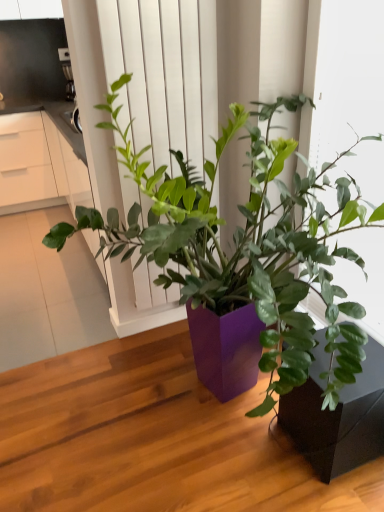
Question: Does matte black pot at lower right have a lesser height compared to white matte screen door at center?

Choices:
 (A) no
 (B) yes

Answer: (B)

Question: Is matte black pot at lower right not close to white matte screen door at center?

Choices:
 (A) yes
 (B) no

Answer: (A)

Question: Is matte black pot at lower right behind white matte screen door at center?

Choices:
 (A) yes
 (B) no

Answer: (B)

Question: Is matte black pot at lower right closer to the viewer compared to white matte screen door at center?

Choices:
 (A) no
 (B) yes

Answer: (B)

Question: Is matte black pot at lower right facing away from white matte screen door at center?

Choices:
 (A) yes
 (B) no

Answer: (B)

Question: Considering their positions, is white matte screen door at center located in front of or behind white matte window frame at upper right?

Choices:
 (A) behind
 (B) front

Answer: (A)

Question: In terms of width, does white matte screen door at center look wider or thinner when compared to white matte window frame at upper right?

Choices:
 (A) thin
 (B) wide

Answer: (A)

Question: Is white matte screen door at center inside or outside of white matte window frame at upper right?

Choices:
 (A) outside
 (B) inside

Answer: (A)

Question: Looking at the image, does white matte screen door at center seem bigger or smaller compared to white matte window frame at upper right?

Choices:
 (A) big
 (B) small

Answer: (B)

Question: Is white matte window frame at upper right in front of or behind brushed metal coffee maker at upper left in the image?

Choices:
 (A) front
 (B) behind

Answer: (A)

Question: Considering the positions of white matte window frame at upper right and brushed metal coffee maker at upper left in the image, is white matte window frame at upper right wider or thinner than brushed metal coffee maker at upper left?

Choices:
 (A) thin
 (B) wide

Answer: (A)

Question: From a real-world perspective, is white matte window frame at upper right physically located above or below brushed metal coffee maker at upper left?

Choices:
 (A) below
 (B) above

Answer: (A)

Question: Considering the positions of white matte window frame at upper right and brushed metal coffee maker at upper left in the image, is white matte window frame at upper right bigger or smaller than brushed metal coffee maker at upper left?

Choices:
 (A) big
 (B) small

Answer: (A)

Question: From the image's perspective, relative to matte black pot at lower right, is white matte window frame at upper right above or below?

Choices:
 (A) below
 (B) above

Answer: (B)

Question: Is point (349, 48) closer or farther from the camera than point (302, 403)?

Choices:
 (A) closer
 (B) farther

Answer: (A)